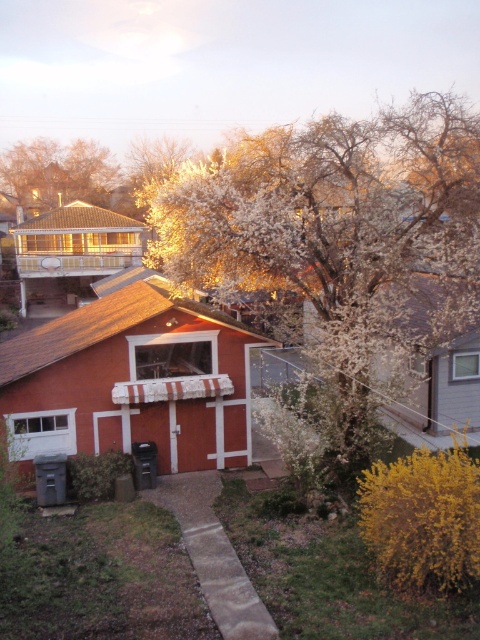
Question: Is white blossoming tree at upper center smaller than fluffy white blossoms at upper left?

Choices:
 (A) yes
 (B) no

Answer: (B)

Question: Is matte red wood shed at center below fluffy white blossoms at upper left?

Choices:
 (A) yes
 (B) no

Answer: (A)

Question: Which object appears farthest from the camera in this image?

Choices:
 (A) fluffy white blossoms at upper left
 (B) white blossoming tree at upper center
 (C) matte red wood shed at center

Answer: (A)

Question: Estimate the real-world distances between objects in this image. Which object is farther from the matte red wood shed at center?

Choices:
 (A) fluffy white blossoms at upper left
 (B) white blossoming tree at upper center

Answer: (A)

Question: Which object appears farthest from the camera in this image?

Choices:
 (A) white blossoming tree at upper center
 (B) matte red wood shed at center

Answer: (B)

Question: Does white blossoming tree at upper center appear on the right side of matte red wood shed at center?

Choices:
 (A) yes
 (B) no

Answer: (A)